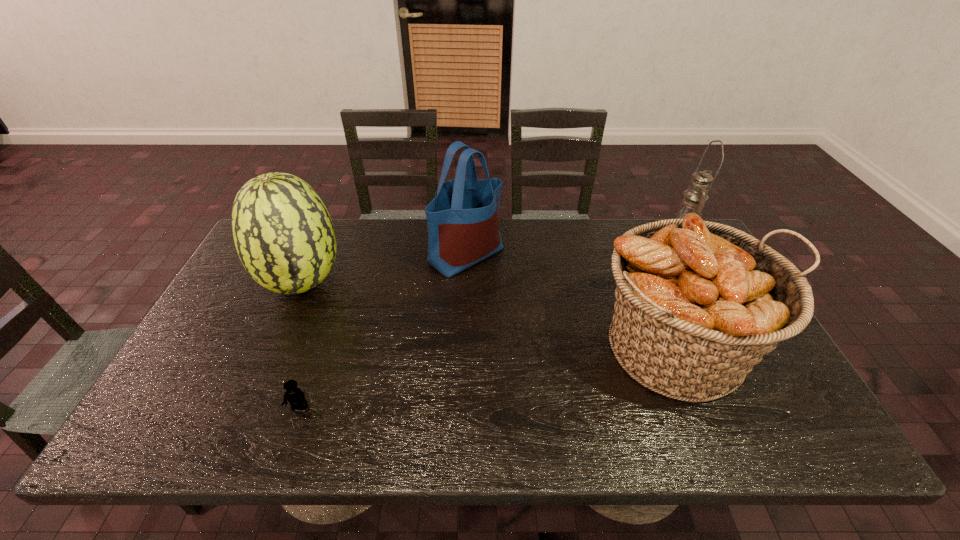
In order to click on free space that is in between the oil lamp and the Lego in this screenshot , I will do `click(489, 326)`.

Where is `vacant space that is in between the handbag and the basket`? This screenshot has height=540, width=960. vacant space that is in between the handbag and the basket is located at coordinates (572, 301).

What are the coordinates of `vacant point located between the basket and the third object from left to right` in the screenshot? It's located at (572, 301).

You are a GUI agent. You are given a task and a screenshot of the screen. Output one action in this format:
    pyautogui.click(x=<x>, y=<y>)
    Task: Click on the object that is the second closest to the watermelon
    
    Given the screenshot: What is the action you would take?
    pyautogui.click(x=296, y=398)

Where is `the fourth closest object to the handbag`? This screenshot has height=540, width=960. the fourth closest object to the handbag is located at coordinates (695, 196).